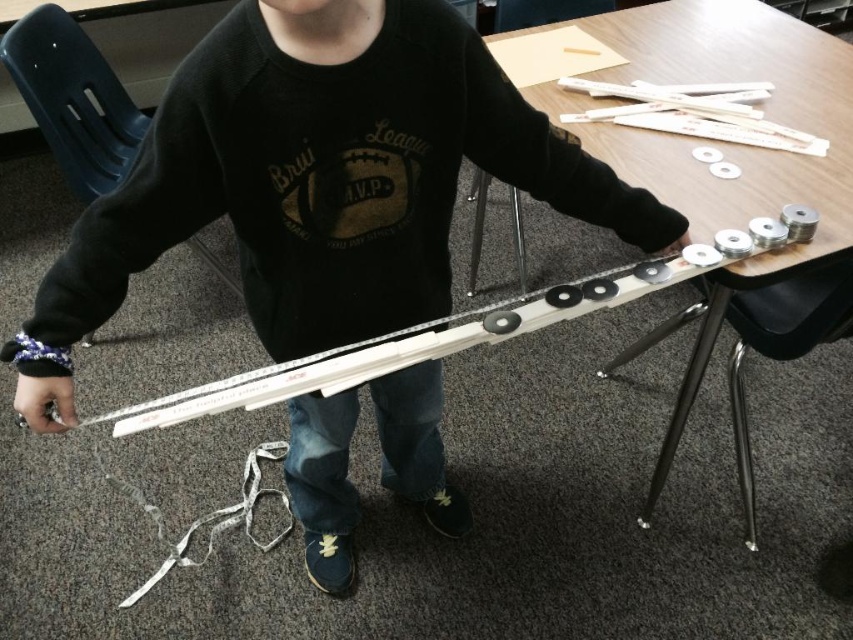
Question: Does wooden table at center appear under matte black hand at upper center?

Choices:
 (A) no
 (B) yes

Answer: (A)

Question: Which point is farther from the camera taking this photo?

Choices:
 (A) (682, 241)
 (B) (695, 61)

Answer: (B)

Question: Is matte black hand at lower left above matte black hand at upper center?

Choices:
 (A) yes
 (B) no

Answer: (B)

Question: Is wooden table at center positioned at the back of matte black hand at lower left?

Choices:
 (A) no
 (B) yes

Answer: (B)

Question: Estimate the real-world distances between objects in this image. Which object is farther from the wooden table at center?

Choices:
 (A) matte black hand at upper center
 (B) matte black hand at lower left

Answer: (B)

Question: Considering the real-world distances, which object is farthest from the matte black hand at upper center?

Choices:
 (A) wooden table at center
 (B) matte black hand at lower left

Answer: (B)